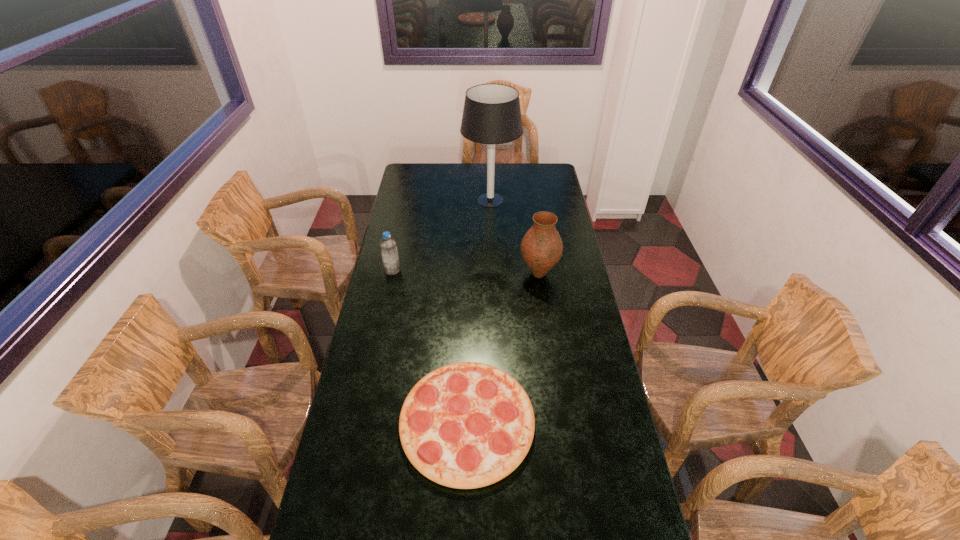
Locate an element on the screen. vacant space positioned on the right of the shortest object is located at coordinates (596, 422).

In order to click on object at the far edge in this screenshot , I will do `click(491, 115)`.

Where is `object present at the left edge`? Image resolution: width=960 pixels, height=540 pixels. object present at the left edge is located at coordinates coord(388,246).

This screenshot has width=960, height=540. I want to click on object present at the right edge, so click(x=541, y=248).

This screenshot has height=540, width=960. Find the location of `vacant space at the far edge`. vacant space at the far edge is located at coordinates (497, 170).

Locate an element on the screen. The image size is (960, 540). free space at the left edge of the desktop is located at coordinates (363, 343).

Where is `free space at the right edge of the desktop`? free space at the right edge of the desktop is located at coordinates (554, 213).

The image size is (960, 540). Identify the location of blank space at the far left corner of the desktop. (432, 171).

Where is `free space at the far right corner of the desktop`? free space at the far right corner of the desktop is located at coordinates (543, 163).

Locate an element on the screen. The height and width of the screenshot is (540, 960). free spot between the second shortest object and the nearest object is located at coordinates (430, 346).